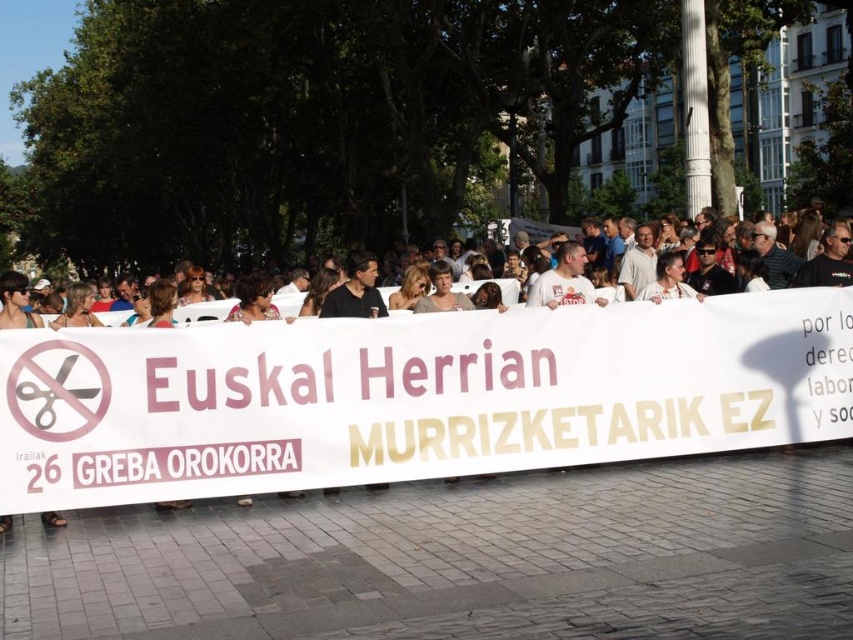
Question: Which object is farther from the camera taking this photo?

Choices:
 (A) white paper banner at center
 (B) white cloth banner at center

Answer: (B)

Question: Can you confirm if white paper banner at center is positioned above white cloth banner at center?

Choices:
 (A) yes
 (B) no

Answer: (B)

Question: In this image, where is white paper banner at center located relative to white cloth banner at center?

Choices:
 (A) above
 (B) below

Answer: (B)

Question: Does white paper banner at center appear over white cloth banner at center?

Choices:
 (A) yes
 (B) no

Answer: (B)